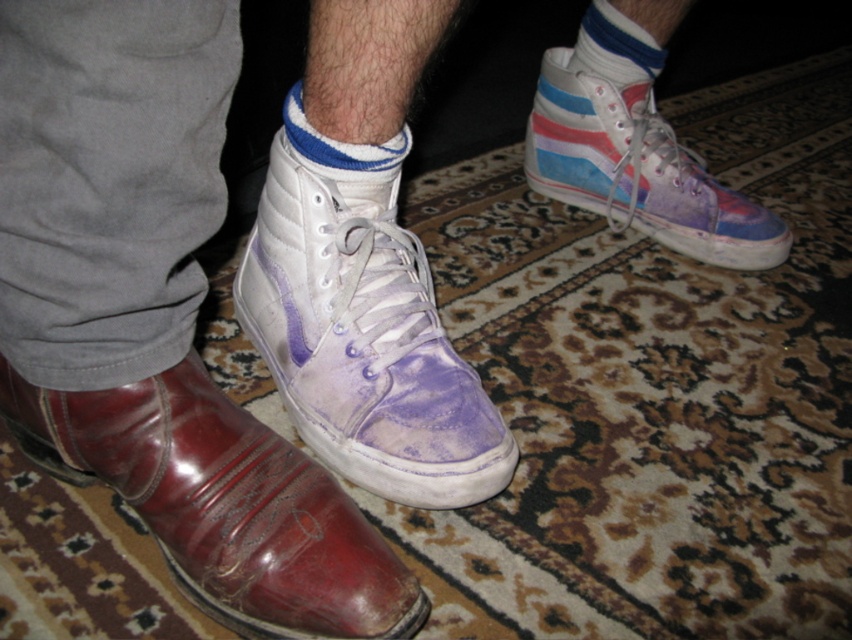
In the scene shown: You are trying to determine which item reaches higher up the leg. Based on the scene, which one is taller between the shiny brown leather boot at lower left and the blue striped sock at upper center?

The shiny brown leather boot at lower left is taller than the blue striped sock at upper center according to the description.

You are standing at the point marked by the coordinates point (625, 17) and want to walk towards the front door located 10 feet away. Can you safely walk straight ahead without hitting any obstacles?

The point (625, 17) is 3.67 feet away from the viewer. Since the front door is 10 feet away, you can safely walk straight ahead as there is enough distance between the point and the door.